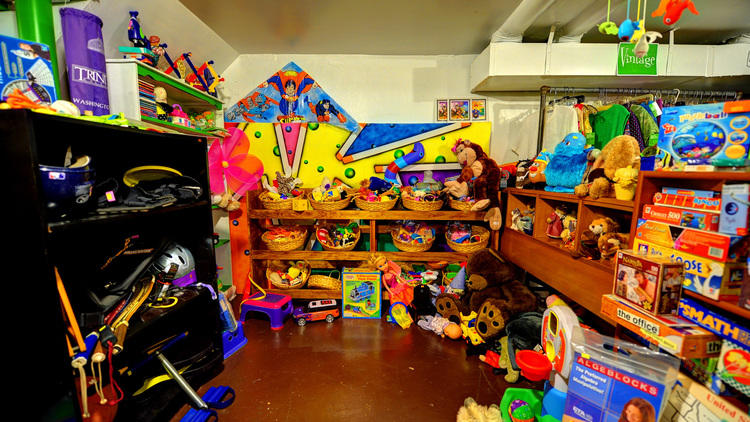
Locate an element on the screen. Image resolution: width=750 pixels, height=422 pixels. stuffed animals is located at coordinates (567, 155), (624, 168), (604, 229), (609, 242), (566, 234), (480, 171).